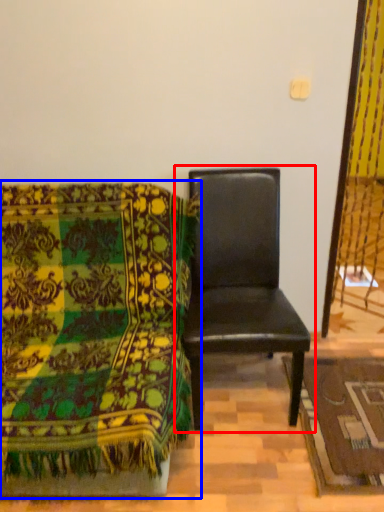
Question: Which object appears closest to the camera in this image, chair (highlighted by a red box) or chair (highlighted by a blue box)?

Choices:
 (A) chair
 (B) chair

Answer: (B)